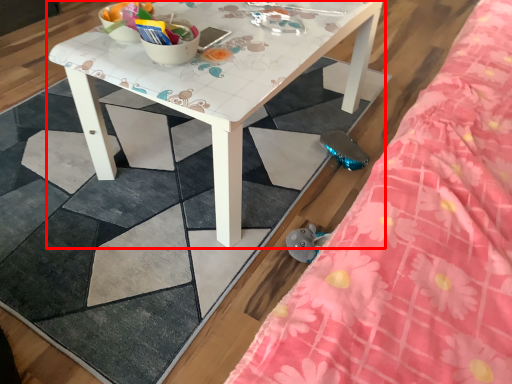
Question: Considering the relative positions of table (annotated by the red box) and bed in the image provided, where is table (annotated by the red box) located with respect to the staircase?

Choices:
 (A) left
 (B) right

Answer: (A)